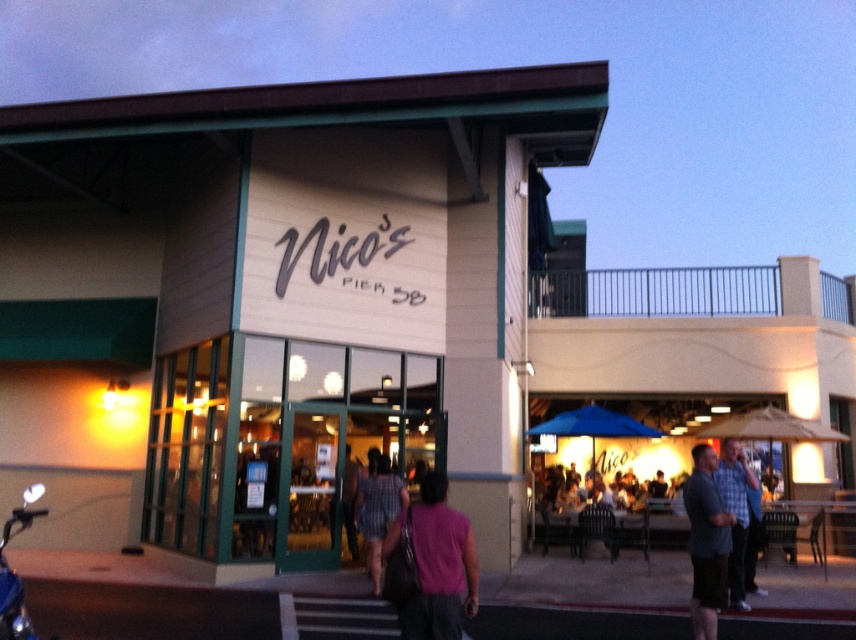
Can you confirm if pink fabric shirt at center is taller than plaid fabric shirt at center?

In fact, pink fabric shirt at center may be shorter than plaid fabric shirt at center.

In the scene shown: Can you confirm if pink fabric shirt at center is smaller than plaid fabric shirt at center?

Correct, pink fabric shirt at center occupies less space than plaid fabric shirt at center.

What do you see at coordinates (431, 564) in the screenshot? I see `pink fabric shirt at center` at bounding box center [431, 564].

The width and height of the screenshot is (856, 640). Find the location of `pink fabric shirt at center`. pink fabric shirt at center is located at coordinates (431, 564).

Who is more forward, (706, 522) or (373, 545)?

Point (706, 522) is more forward.

Which is behind, point (714, 541) or point (391, 515)?

Positioned behind is point (391, 515).

What are the coordinates of `matte gray shirt at center` in the screenshot? It's located at (706, 541).

Consider the image. Which of these two, pink fabric shirt at center or plaid shirt at center, stands taller?

plaid shirt at center is taller.

Between pink fabric shirt at center and plaid shirt at center, which one is positioned lower?

Positioned lower is plaid shirt at center.

Locate an element on the screen. Image resolution: width=856 pixels, height=640 pixels. pink fabric shirt at center is located at coordinates (431, 564).